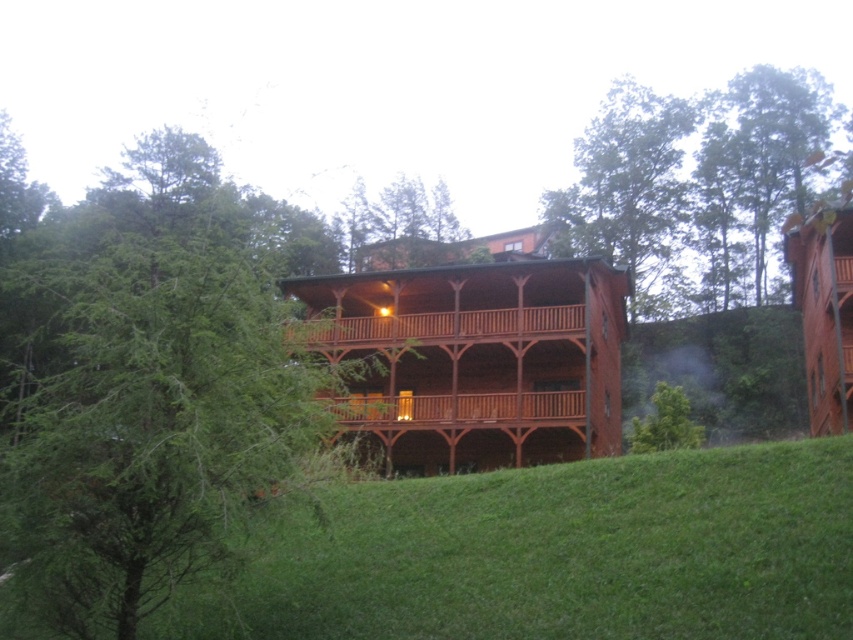
Does green needle-like tree at center-left have a smaller size compared to wooden at center?

Actually, green needle-like tree at center-left might be larger than wooden at center.

Is point (279, 298) farther from viewer compared to point (579, 307)?

Yes.

Who is more distant from viewer, (155, 266) or (581, 308)?

Positioned behind is point (581, 308).

Find the location of a particular element. The height and width of the screenshot is (640, 853). green needle-like tree at center-left is located at coordinates (154, 428).

Who is shorter, green needle-like tree at center-left or green leafy tree at upper right?

Standing shorter between the two is green needle-like tree at center-left.

Can you confirm if green needle-like tree at center-left is positioned above green leafy tree at upper right?

Incorrect, green needle-like tree at center-left is not positioned above green leafy tree at upper right.

This screenshot has width=853, height=640. In order to click on green needle-like tree at center-left in this screenshot , I will do `click(154, 428)`.

Between green needle-like tree at center-left and wooden balcony at center, which one appears on the left side from the viewer's perspective?

Positioned to the left is green needle-like tree at center-left.

Is point (44, 280) positioned after point (360, 401)?

No, it is not.

The height and width of the screenshot is (640, 853). In order to click on green needle-like tree at center-left in this screenshot , I will do `click(154, 428)`.